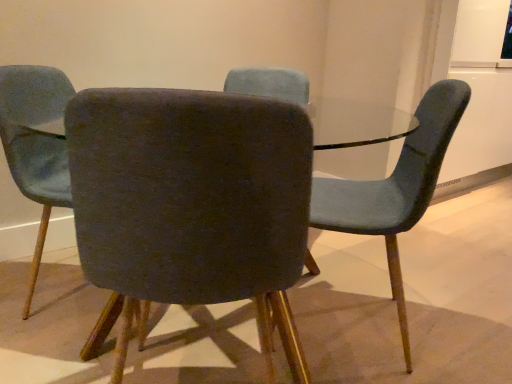
At what (x,y) coordinates should I click in order to perform the action: click on vacant space behind velvet teal chair at right, acting as the 1th chair starting from the right. Please return your answer as a coordinate pair (x, y). Looking at the image, I should click on (352, 263).